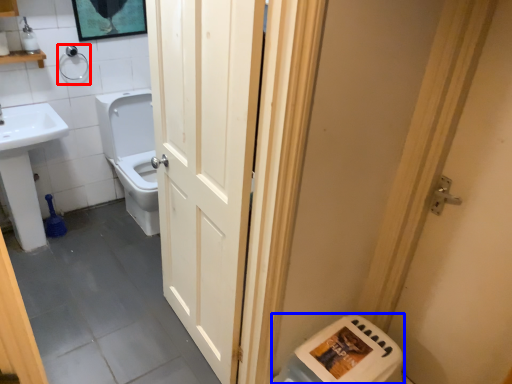
Question: Among these objects, which one is farthest to the camera, towel bar (highlighted by a red box) or water heater (highlighted by a blue box)?

Choices:
 (A) towel bar
 (B) water heater

Answer: (A)